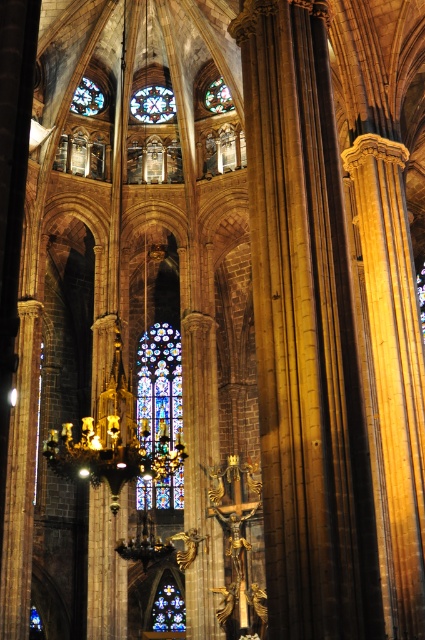
Can you confirm if stained glass window at center is wider than stained glass window at upper left?

Yes, stained glass window at center is wider than stained glass window at upper left.

Does stained glass window at center have a smaller size compared to stained glass window at upper left?

No, stained glass window at center is not smaller than stained glass window at upper left.

Between point (152, 436) and point (70, 104), which one is positioned in front?

Positioned in front is point (70, 104).

The width and height of the screenshot is (425, 640). I want to click on stained glass window at center, so click(x=159, y=381).

Can you confirm if golden polished stone column at center is taller than stained glass window at upper left?

Yes.

Describe the element at coordinates (393, 358) in the screenshot. I see `golden polished stone column at center` at that location.

Where is `golden polished stone column at center`? The height and width of the screenshot is (640, 425). golden polished stone column at center is located at coordinates (393, 358).

Between stained glass at upper center and stained glass window at upper left, which one is positioned higher?

stained glass at upper center is higher up.

Is point (149, 93) closer to camera compared to point (102, 100)?

No, (149, 93) is further to viewer.

I want to click on stained glass at upper center, so click(153, 104).